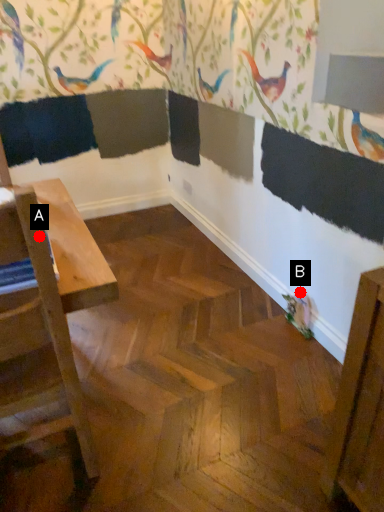
Question: Two points are circled on the image, labeled by A and B beside each circle. Which of the following is the farthest from the observer?

Choices:
 (A) A is further
 (B) B is further

Answer: (B)